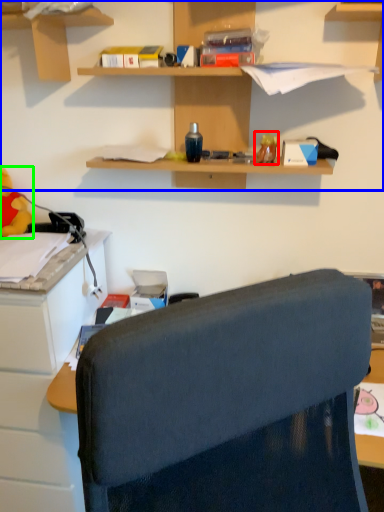
Question: Which object is the closest to the toy (highlighted by a red box)? Choose among these: shelf (highlighted by a blue box) or toy (highlighted by a green box).

Choices:
 (A) shelf
 (B) toy

Answer: (A)